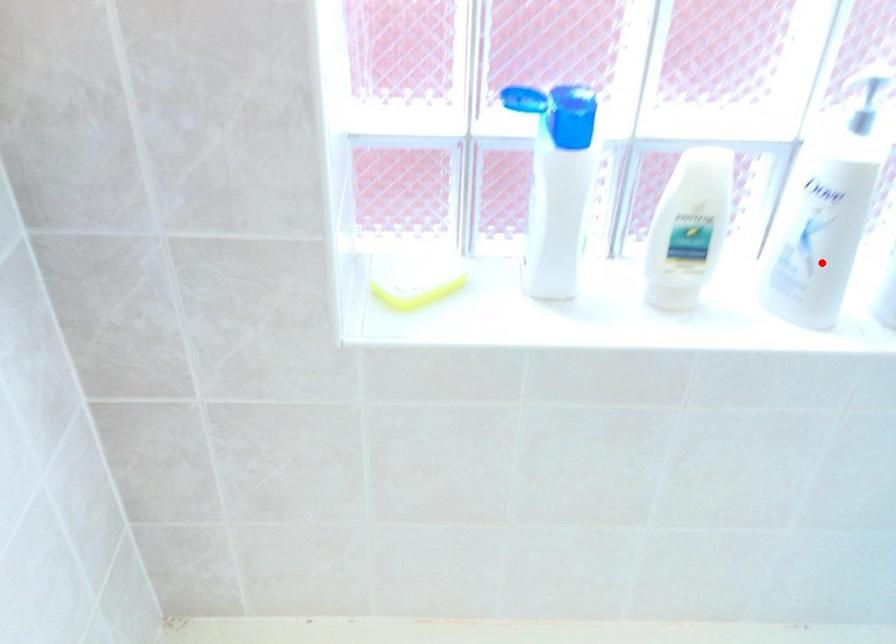
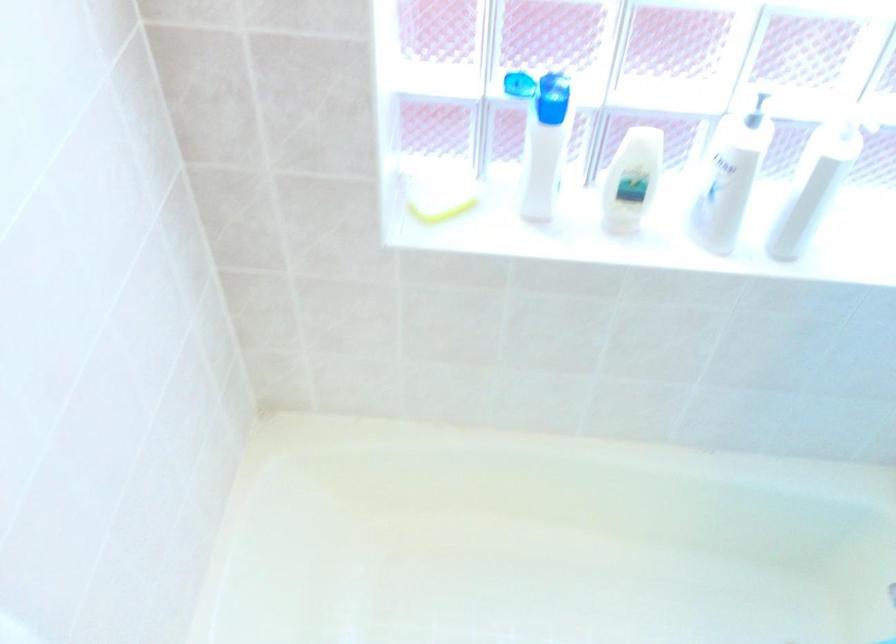
In the second image, find the point that corresponds to the highlighted location in the first image.

(721, 211)